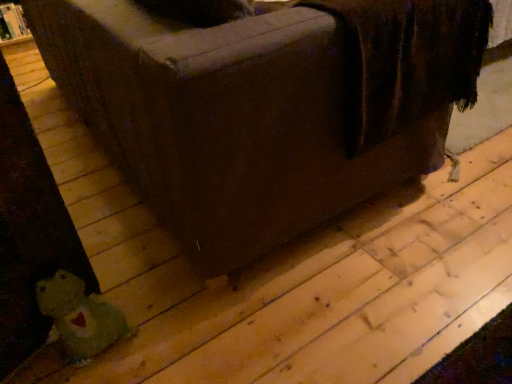
Question: In the image, is green plush toy at lower left positioned in front of or behind green plush bear at lower left?

Choices:
 (A) front
 (B) behind

Answer: (B)

Question: Is green plush toy at lower left taller or shorter than green plush bear at lower left?

Choices:
 (A) tall
 (B) short

Answer: (B)

Question: Looking at the image, does green plush toy at lower left seem bigger or smaller compared to green plush bear at lower left?

Choices:
 (A) small
 (B) big

Answer: (A)

Question: Considering the positions of green plush bear at lower left and green plush toy at lower left in the image, is green plush bear at lower left bigger or smaller than green plush toy at lower left?

Choices:
 (A) big
 (B) small

Answer: (A)

Question: From the image's perspective, is green plush bear at lower left located above or below green plush toy at lower left?

Choices:
 (A) below
 (B) above

Answer: (B)

Question: In the image, is green plush bear at lower left on the left side or the right side of green plush toy at lower left?

Choices:
 (A) left
 (B) right

Answer: (B)

Question: In terms of height, does green plush bear at lower left look taller or shorter compared to green plush toy at lower left?

Choices:
 (A) short
 (B) tall

Answer: (B)